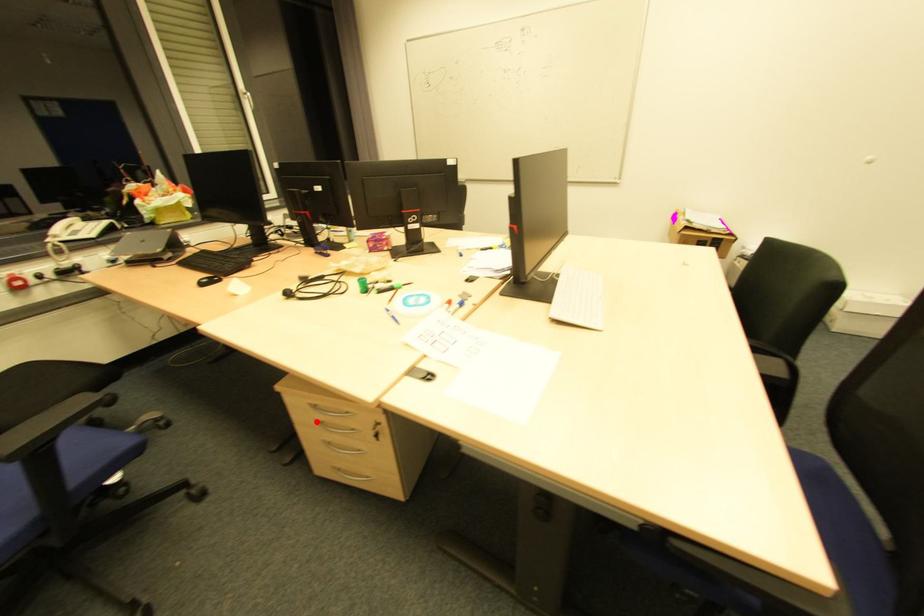
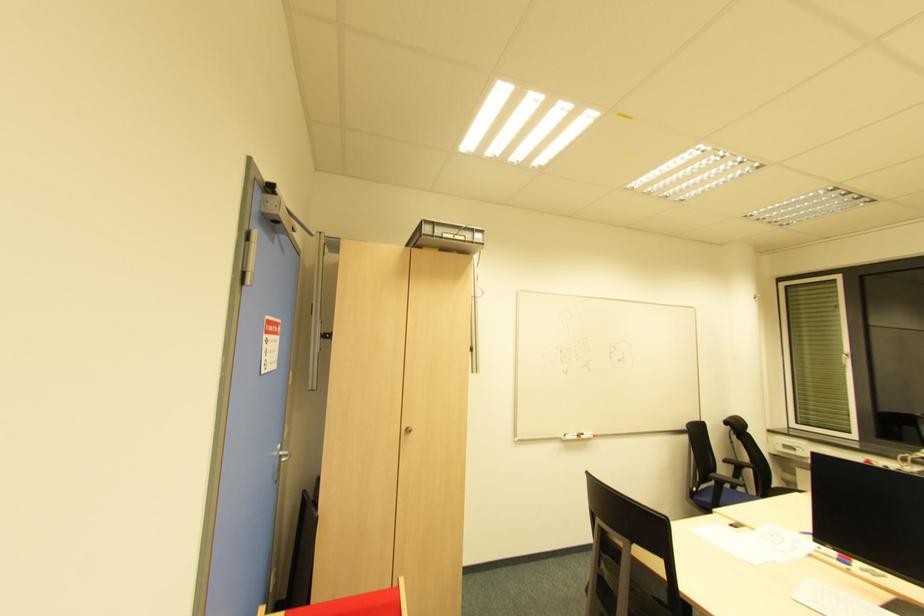
Question: I am providing you with two images of the same scene from different viewpoints. A red point is marked on the first image. At the location where the point appears in image 1, is it still visible in image 2?

Choices:
 (A) Yes
 (B) No

Answer: (B)